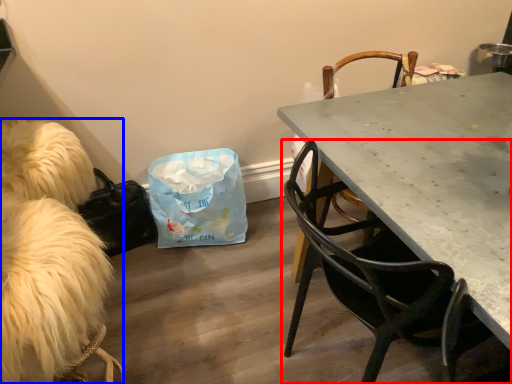
Question: Among these objects, which one is nearest to the camera, chair (highlighted by a red box) or animal (highlighted by a blue box)?

Choices:
 (A) chair
 (B) animal

Answer: (A)